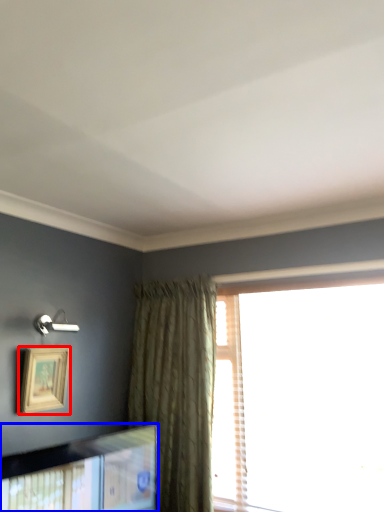
Question: Which point is closer to the camera, picture frame (highlighted by a red box) or picture frame (highlighted by a blue box)?

Choices:
 (A) picture frame
 (B) picture frame

Answer: (B)